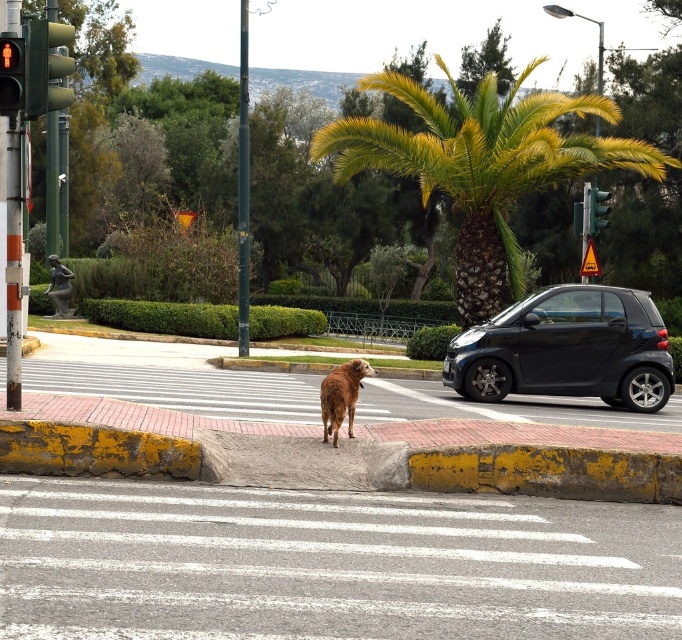
Question: Does white asphalt at center appear on the left side of green glass traffic light at upper right?

Choices:
 (A) no
 (B) yes

Answer: (B)

Question: Can you confirm if red matte pedestrian signal at left is positioned above green glass traffic light at upper right?

Choices:
 (A) yes
 (B) no

Answer: (B)

Question: Which of these objects is positioned farthest from the green matte traffic light at upper left?

Choices:
 (A) green glass traffic light at upper right
 (B) white asphalt at center
 (C) brown fur dog at center
 (D) brown furry dog at center

Answer: (A)

Question: Which object is the farthest from the green matte traffic light at upper left?

Choices:
 (A) brown furry dog at center
 (B) red matte pedestrian signal at left

Answer: (A)

Question: Estimate the real-world distances between objects in this image. Which object is farther from the brown fur dog at center?

Choices:
 (A) black glossy car at right
 (B) red matte pedestrian signal at left
 (C) green matte traffic light at upper left

Answer: (C)

Question: Observing the image, what is the correct spatial positioning of yellow-green fronds at center in reference to green glass traffic light at upper right?

Choices:
 (A) right
 (B) left

Answer: (B)